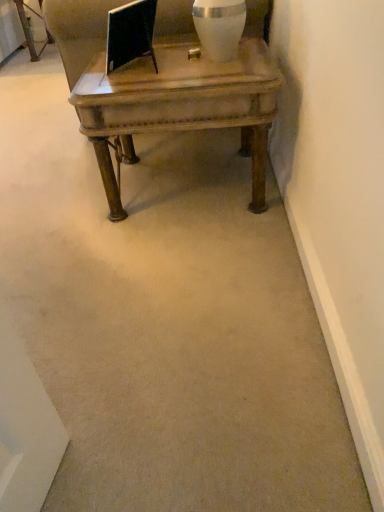
This screenshot has width=384, height=512. Identify the location of vacant space in white glossy vase at upper center (from a real-world perspective). (218, 60).